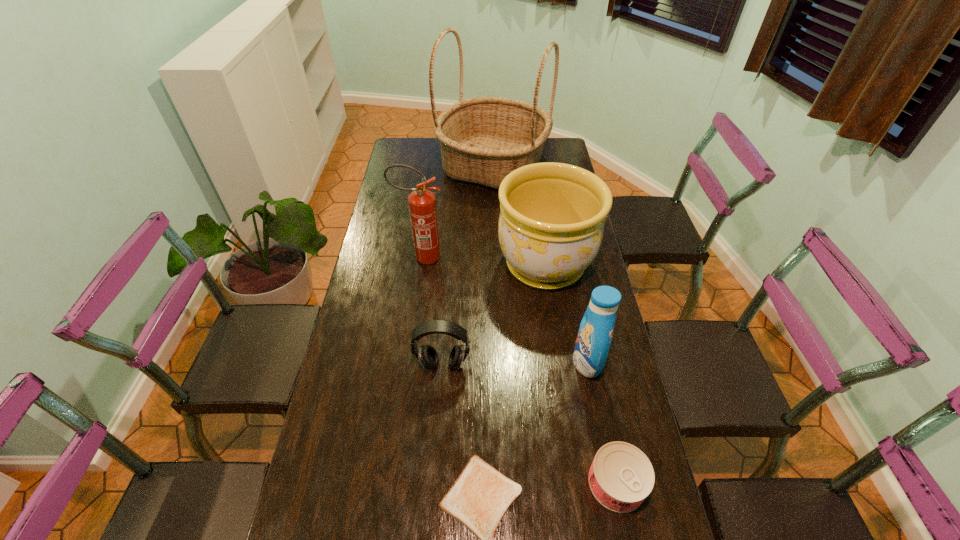
The height and width of the screenshot is (540, 960). I want to click on can that is at the right edge, so click(x=621, y=476).

Where is `object located in the far right corner section of the desktop`? object located in the far right corner section of the desktop is located at coordinates (482, 139).

In the image, there is a desktop. Where is `vacant space at the far edge`? The width and height of the screenshot is (960, 540). vacant space at the far edge is located at coordinates (430, 142).

The width and height of the screenshot is (960, 540). Find the location of `vacant space at the left edge`. vacant space at the left edge is located at coordinates (310, 474).

You are a GUI agent. You are given a task and a screenshot of the screen. Output one action in this format:
    pyautogui.click(x=<x>, y=<y>)
    Task: Click on the free space at the right edge
    The width and height of the screenshot is (960, 540).
    Given the screenshot: What is the action you would take?
    pyautogui.click(x=575, y=370)

Locate an element on the screen. free spot between the detergent and the earphone is located at coordinates (515, 363).

At what (x,y) coordinates should I click in order to perform the action: click on empty space that is in between the fire extinguisher and the third shortest object. Please return your answer as a coordinate pair (x, y). Looking at the image, I should click on (432, 311).

Identify the location of free space between the flowerpot and the fifth tallest object. (493, 315).

Locate which object ranks fourth in proximity to the basket. Please provide its 2D coordinates. Your answer should be formatted as a tuple, i.e. [(x, y)], where the tuple contains the x and y coordinates of a point satisfying the conditions above.

[(427, 355)]

The image size is (960, 540). Find the location of `object that is the second closest one to the flowerpot`. object that is the second closest one to the flowerpot is located at coordinates tap(422, 204).